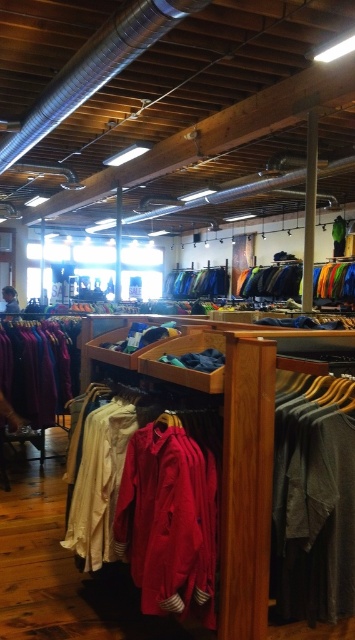
Who is positioned more to the left, velvet purple sweater at left or blue fabric pants at center?

From the viewer's perspective, velvet purple sweater at left appears more on the left side.

Who is shorter, velvet purple sweater at left or blue fabric pants at center?

blue fabric pants at center is shorter.

Locate an element on the screen. velvet purple sweater at left is located at coordinates (39, 368).

Can you confirm if dark gray fabric shirt at center is wider than blue fabric pants at center?

In fact, dark gray fabric shirt at center might be narrower than blue fabric pants at center.

Does point (297, 497) come farther from viewer compared to point (204, 268)?

No.

Where is `dark gray fabric shirt at center`? This screenshot has width=355, height=640. dark gray fabric shirt at center is located at coordinates (314, 499).

Is point (325, 536) positioned before point (133, 492)?

Yes, point (325, 536) is in front of point (133, 492).

Between dark gray fabric shirt at center and matte red shirt at center, which one appears on the right side from the viewer's perspective?

Positioned to the right is dark gray fabric shirt at center.

Which is behind, point (299, 428) or point (177, 541)?

The point (177, 541) is behind.

This screenshot has height=640, width=355. In order to click on dark gray fabric shirt at center in this screenshot , I will do `click(314, 499)`.